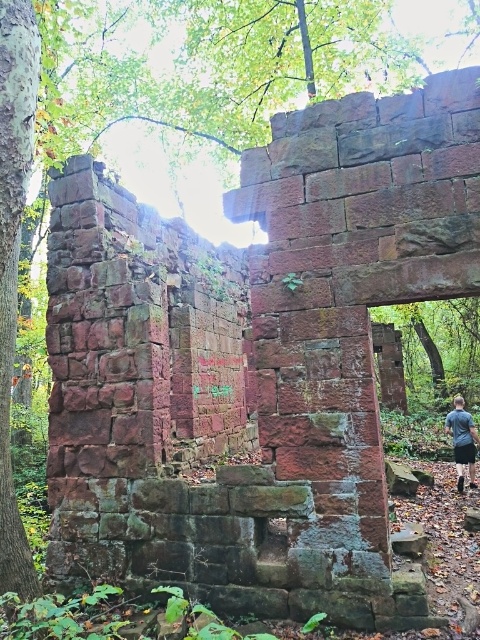
You are standing at the entrance of the ancient stone structure and see two points marked in the scene. Which point is closer to you, point (12, 193) or point (476, 483)?

Point (12, 193) is closer to the camera than point (476, 483), so the point closer to you is point (12, 193).

You are an archaeologist exploring the ancient stone structure. You need to retrieve an artifact from the smooth bark tree at left but are currently standing at the dark gray shirt at lower right. Can you reach the tree without moving more than 5 meters?

The distance between the smooth bark tree at left and the dark gray shirt at lower right is 6.01 meters, which is more than 5 meters. Therefore, you cannot reach the tree without moving more than 5 meters.

You are an archaeologist exploring the ancient stone structure. You notice a smooth bark tree at left and a dark gray shirt at lower right. Which object is wider?

The smooth bark tree at left might be wider than dark gray shirt at lower right.